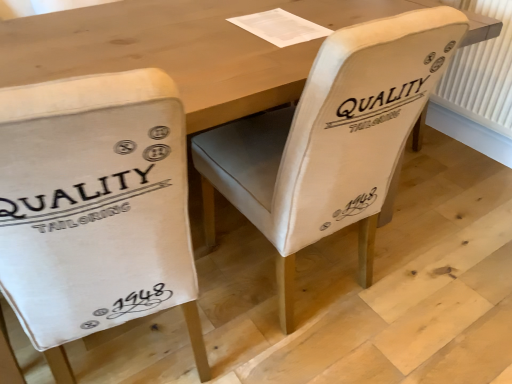
Question: Is white plastic radiator at right far from white canvas chair at left, acting as the first chair starting from the left?

Choices:
 (A) no
 (B) yes

Answer: (B)

Question: Does white plastic radiator at right come in front of white canvas chair at left, acting as the first chair starting from the left?

Choices:
 (A) yes
 (B) no

Answer: (B)

Question: Does white plastic radiator at right contain white canvas chair at left, which ranks as the 2th chair in right-to-left order?

Choices:
 (A) yes
 (B) no

Answer: (B)

Question: Is white plastic radiator at right oriented towards white canvas chair at left, acting as the first chair starting from the left?

Choices:
 (A) no
 (B) yes

Answer: (B)

Question: From a real-world perspective, does white plastic radiator at right sit lower than white canvas chair at left, which ranks as the 2th chair in right-to-left order?

Choices:
 (A) yes
 (B) no

Answer: (A)

Question: Are white plastic radiator at right and white canvas chair at left, which ranks as the 2th chair in right-to-left order, making contact?

Choices:
 (A) no
 (B) yes

Answer: (A)

Question: Could you tell me if white fabric chair at center, the 2th chair from the left, is facing white plastic radiator at right?

Choices:
 (A) no
 (B) yes

Answer: (A)

Question: Considering the relative sizes of white fabric chair at center, which appears as the first chair when viewed from the right, and white plastic radiator at right in the image provided, is white fabric chair at center, which appears as the first chair when viewed from the right, bigger than white plastic radiator at right?

Choices:
 (A) no
 (B) yes

Answer: (B)

Question: Considering the relative sizes of white fabric chair at center, which appears as the first chair when viewed from the right, and white plastic radiator at right in the image provided, is white fabric chair at center, which appears as the first chair when viewed from the right, shorter than white plastic radiator at right?

Choices:
 (A) yes
 (B) no

Answer: (B)

Question: Does white fabric chair at center, the 2th chair from the left, have a greater width compared to white plastic radiator at right?

Choices:
 (A) yes
 (B) no

Answer: (A)

Question: Can you confirm if white fabric chair at center, which appears as the first chair when viewed from the right, is positioned to the right of white plastic radiator at right?

Choices:
 (A) yes
 (B) no

Answer: (B)

Question: Can you confirm if white fabric chair at center, the 2th chair from the left, is taller than white plastic radiator at right?

Choices:
 (A) no
 (B) yes

Answer: (B)

Question: Is white fabric chair at center, which appears as the first chair when viewed from the right, facing away from white canvas chair at left, which ranks as the 2th chair in right-to-left order?

Choices:
 (A) no
 (B) yes

Answer: (A)